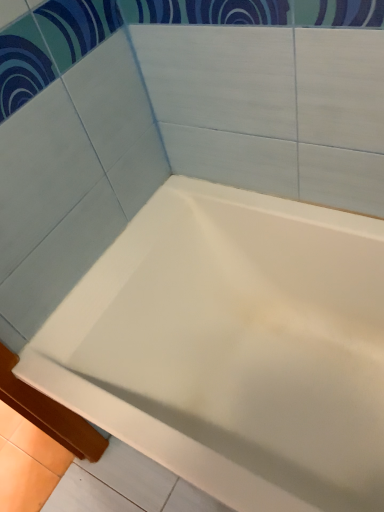
This screenshot has width=384, height=512. Describe the element at coordinates (233, 347) in the screenshot. I see `white glossy bathtub at center` at that location.

Find the location of a particular element. The height and width of the screenshot is (512, 384). white glossy bathtub at center is located at coordinates (233, 347).

Identify the location of white glossy bathtub at center. The height and width of the screenshot is (512, 384). (233, 347).